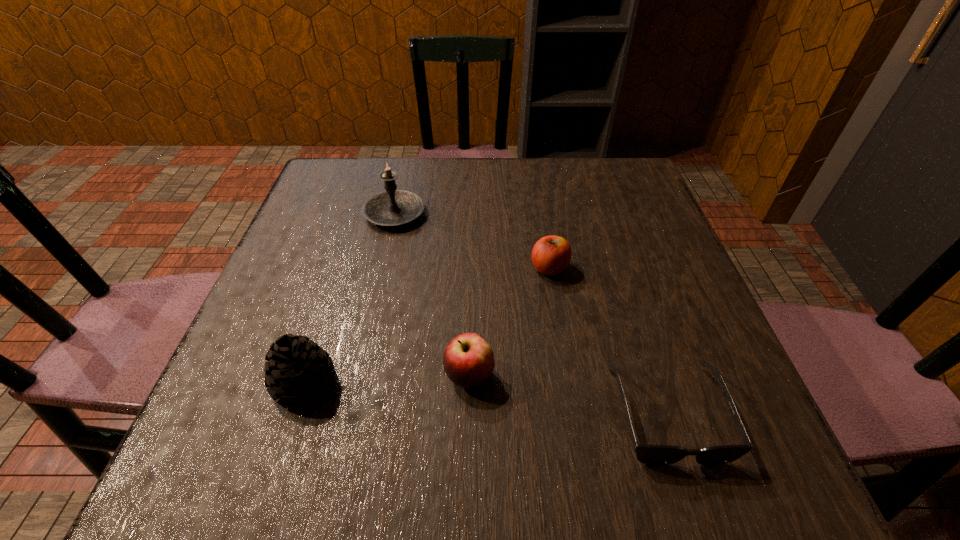
You are a GUI agent. You are given a task and a screenshot of the screen. Output one action in this format:
    pyautogui.click(x=<x>, y=<y>)
    Task: Click on the free space between the shortest object and the candle
    The width and height of the screenshot is (960, 540).
    Given the screenshot: What is the action you would take?
    pyautogui.click(x=531, y=313)

The width and height of the screenshot is (960, 540). In order to click on empty space between the left apple and the second tallest object in this screenshot , I will do `click(387, 379)`.

Where is `free area in between the left apple and the farthest object`? This screenshot has width=960, height=540. free area in between the left apple and the farthest object is located at coordinates (432, 294).

Locate an element on the screen. Image resolution: width=960 pixels, height=540 pixels. vacant region between the farther apple and the sunglasses is located at coordinates (608, 340).

I want to click on free space between the second farthest object and the sunglasses, so click(608, 340).

This screenshot has width=960, height=540. Find the location of `free space between the second tallest object and the left apple`. free space between the second tallest object and the left apple is located at coordinates (387, 379).

Choose which object is the third nearest neighbor to the pinecone. Please provide its 2D coordinates. Your answer should be formatted as a tuple, i.e. [(x, y)], where the tuple contains the x and y coordinates of a point satisfying the conditions above.

[(551, 255)]

The image size is (960, 540). Identify the location of object that can be found as the second closest to the farther apple. (647, 454).

Locate an element on the screen. vacant space that satisfies the following two spatial constraints: 1. on the front side of the left apple; 2. at the narrow end of the pinecone is located at coordinates (469, 383).

I want to click on free location that satisfies the following two spatial constraints: 1. on the front side of the farthest object; 2. at the narrow end of the pinecone, so click(x=357, y=383).